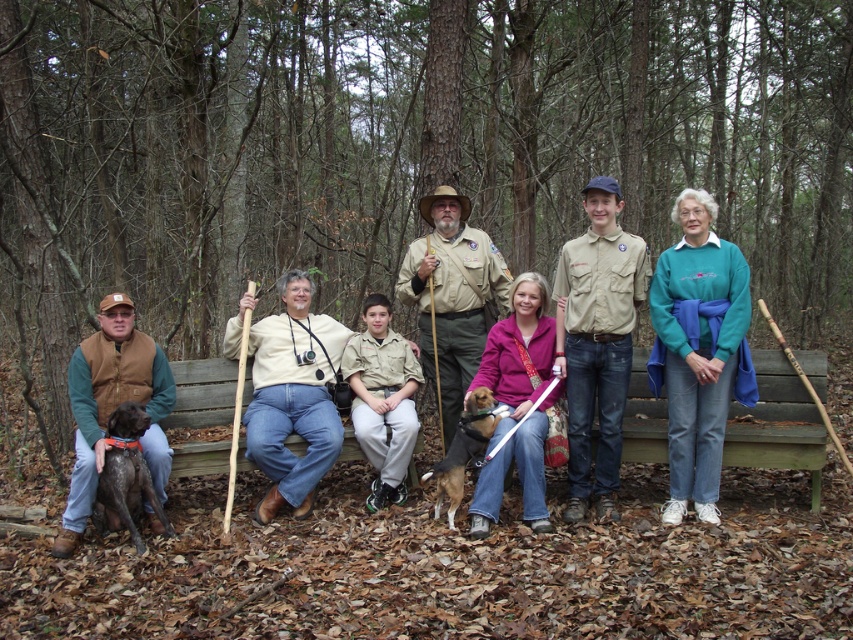
Is khaki uniform pants at center closer to camera compared to purple fleece jacket at center?

No, khaki uniform pants at center is further to the viewer.

Does khaki uniform pants at center have a greater height compared to purple fleece jacket at center?

Indeed, khaki uniform pants at center has a greater height compared to purple fleece jacket at center.

Which is behind, point (282, 275) or point (514, 381)?

The point (282, 275) is more distant.

You are a GUI agent. You are given a task and a screenshot of the screen. Output one action in this format:
    pyautogui.click(x=<x>, y=<y>)
    Task: Click on the khaki uniform pants at center
    Image resolution: width=853 pixels, height=640 pixels.
    Given the screenshot: What is the action you would take?
    pyautogui.click(x=283, y=456)

Can you confirm if light beige shirt at center is thinner than brown suede vest at left?

Incorrect, light beige shirt at center's width is not less than brown suede vest at left's.

Describe the element at coordinates (293, 397) in the screenshot. The image size is (853, 640). I see `light beige shirt at center` at that location.

At what (x,y) coordinates should I click in order to perform the action: click on light beige shirt at center. Please return your answer as a coordinate pair (x, y). Looking at the image, I should click on (293, 397).

Between khaki uniform pants at center and brown speckled fur at lower left, which one has less height?

brown speckled fur at lower left

Find the location of a particular element. This screenshot has height=640, width=853. khaki uniform pants at center is located at coordinates (283, 456).